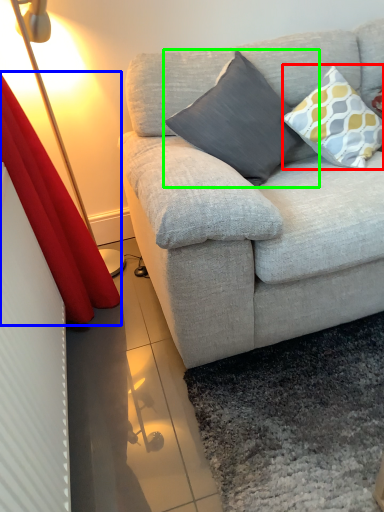
Question: Considering the real-world distances, which object is farthest from pillow (highlighted by a red box)? curtain (highlighted by a blue box) or pillow (highlighted by a green box)?

Choices:
 (A) curtain
 (B) pillow

Answer: (A)